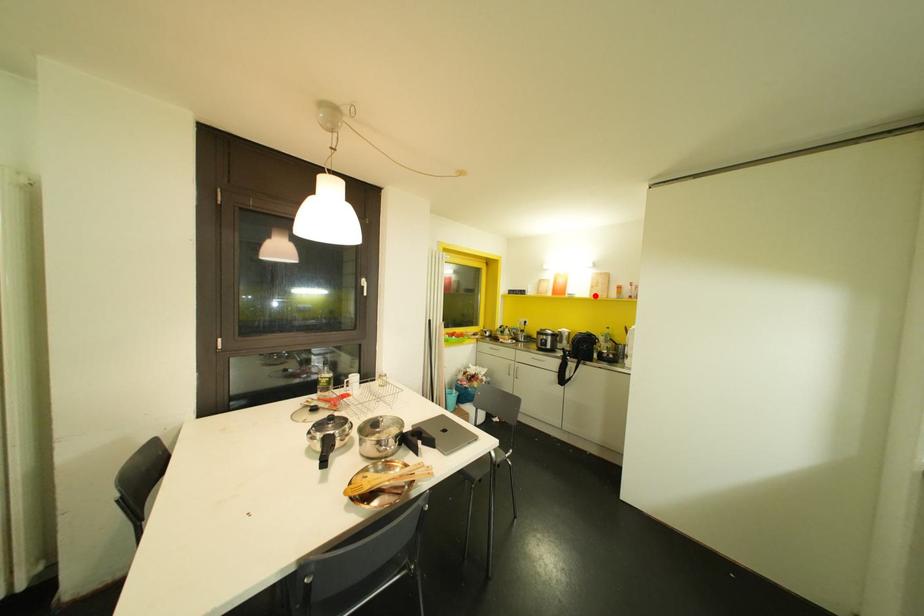
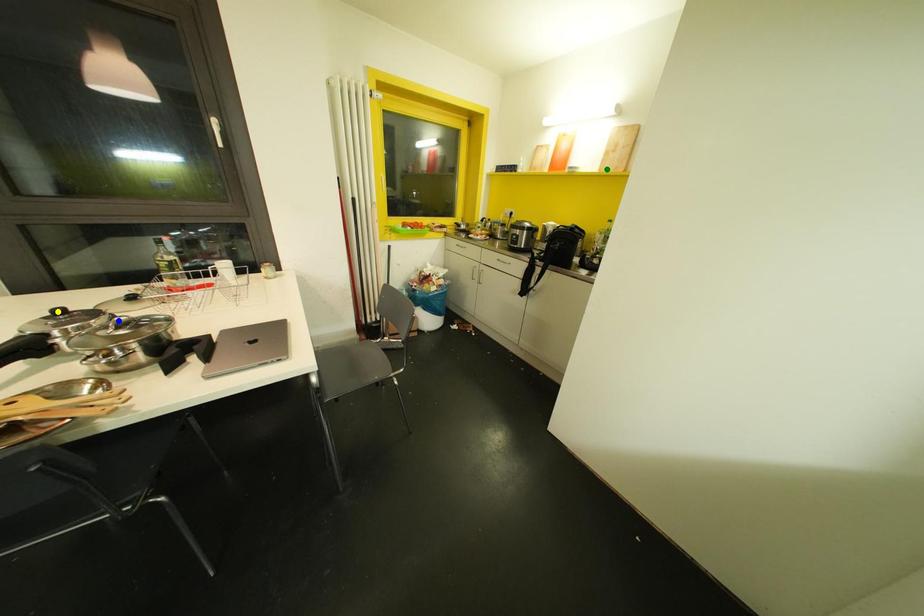
Question: I am providing you with two images of the same scene from different viewpoints. A red point is marked on the first image. You are given multiple points on the second image. Which spot in image 2 lines up with the point in image 1?

Choices:
 (A) yellow point
 (B) green point
 (C) blue point

Answer: (B)